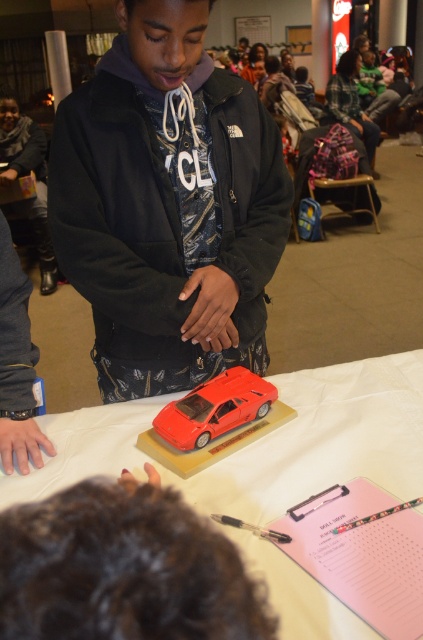
You are setting up a display for a toy exhibition. You have a glossy plastic car at center and a shiny red car at center. You need to place them exactly 6 inches apart. Can you place them as required?

The glossy plastic car at center is currently 5.64 inches from the shiny red car at center. Since 5.64 inches is less than 6 inches, they are not placed exactly 6 inches apart. You need to move them slightly further apart to meet the requirement.

You are at an event and want to pick up the plaid fabric jacket at upper right from the table. However, there is a glossy plastic car at center in your way. Can you reach the jacket without moving the car?

The glossy plastic car at center is below the plaid fabric jacket at upper right, so you can reach the jacket without moving the car because it is positioned above the car.

You are standing in front of the table at the community event. You notice two points marked on the display. The first point is at coordinates point (213, 400) and the second is at point (354, 93). Which point is closer to you?

Point (213, 400) is closer to the camera than point (354, 93), so the first point is closer to you.